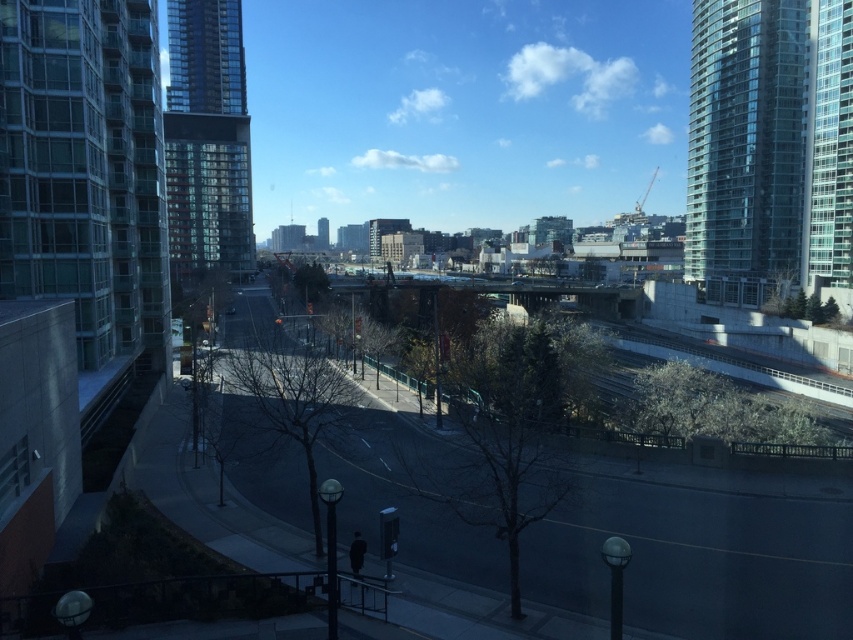
Is point (228, 268) positioned behind point (328, 237)?

No.

Is glassy reflective skyscraper at left taller than glassy skyscraper at center?

Correct, glassy reflective skyscraper at left is much taller as glassy skyscraper at center.

This screenshot has width=853, height=640. In order to click on glassy reflective skyscraper at left in this screenshot , I will do `click(207, 140)`.

Is glassy reflective skyscraper at right smaller than glassy skyscraper at center?

No.

Is glassy reflective skyscraper at right to the right of glassy skyscraper at center from the viewer's perspective?

Indeed, glassy reflective skyscraper at right is positioned on the right side of glassy skyscraper at center.

Who is more forward, (837,131) or (317,232)?

Positioned in front is point (837,131).

At what (x,y) coordinates should I click in order to perform the action: click on glassy reflective skyscraper at right. Please return your answer as a coordinate pair (x, y). This screenshot has width=853, height=640. Looking at the image, I should click on (769, 145).

Who is positioned more to the left, glassy reflective building at left or glassy reflective skyscraper at left?

From the viewer's perspective, glassy reflective skyscraper at left appears more on the left side.

Does glassy reflective building at left have a lesser height compared to glassy reflective skyscraper at left?

Correct, glassy reflective building at left is not as tall as glassy reflective skyscraper at left.

This screenshot has height=640, width=853. I want to click on glassy reflective building at left, so click(85, 170).

You are a GUI agent. You are given a task and a screenshot of the screen. Output one action in this format:
    pyautogui.click(x=<x>, y=<y>)
    Task: Click on the glassy reflective building at left
    The height and width of the screenshot is (640, 853).
    Given the screenshot: What is the action you would take?
    pyautogui.click(x=85, y=170)